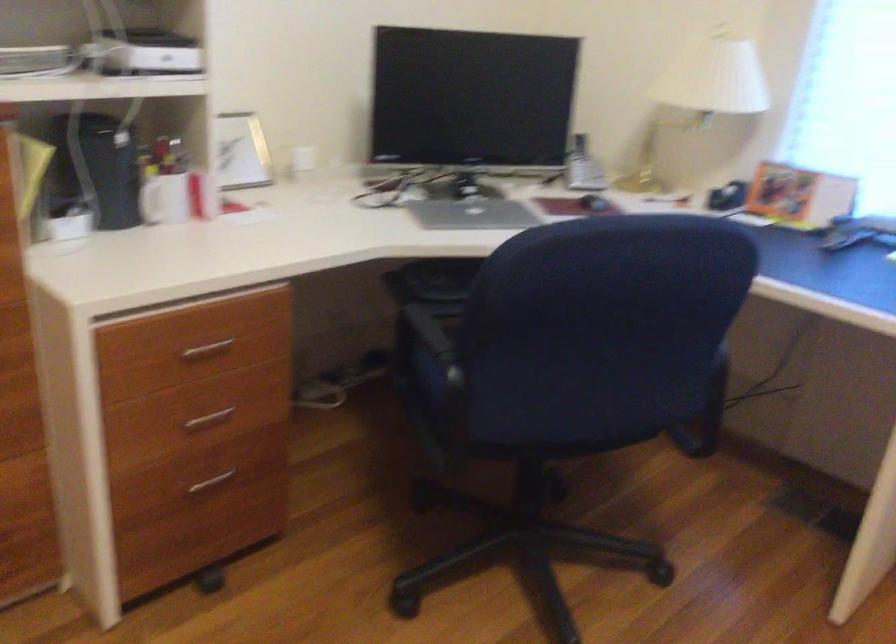
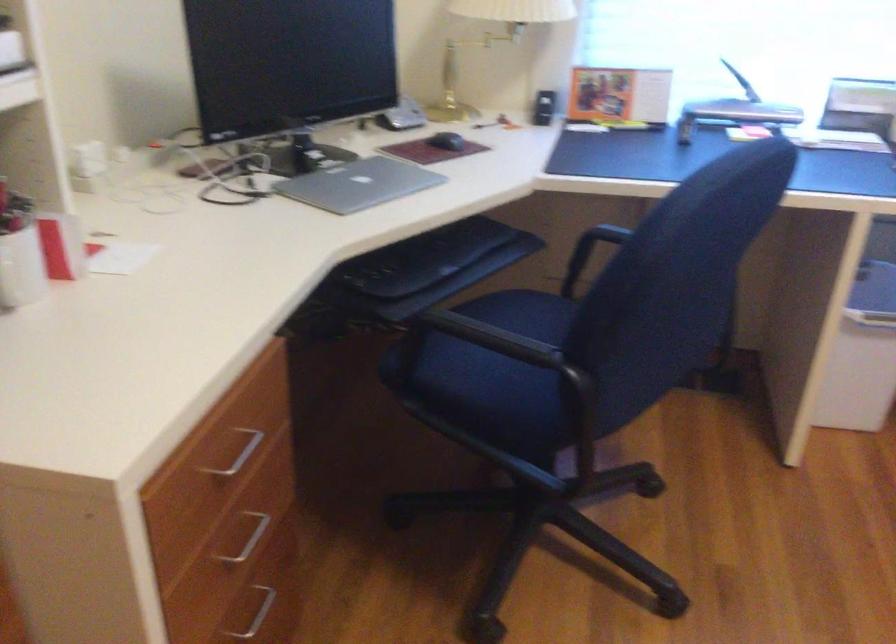
Find the pixel in the second image that matches (213,418) in the first image.

(247, 538)